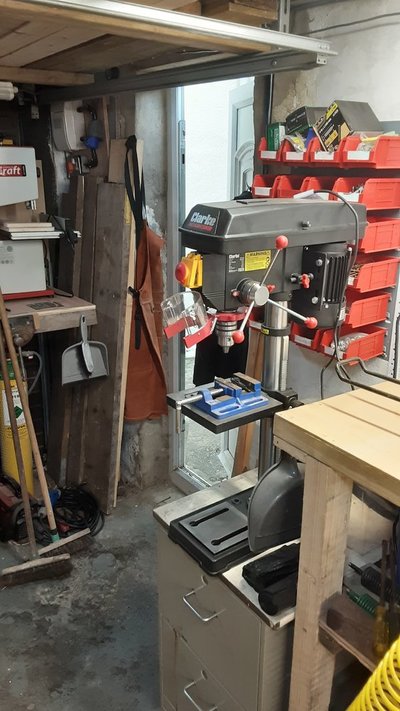
You are a GUI agent. You are given a task and a screenshot of the screen. Output one action in this format:
    pyautogui.click(x=<x>, y=<y>)
    Task: Click on the extension cords
    This screenshot has height=711, width=400.
    Given the screenshot: What is the action you would take?
    pyautogui.click(x=97, y=513)